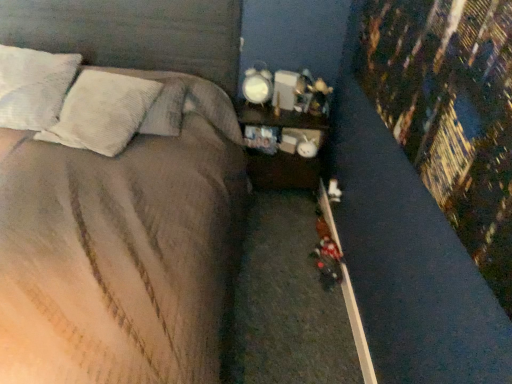
What do you see at coordinates (283, 171) in the screenshot?
I see `wooden nightstand at center` at bounding box center [283, 171].

You are a GUI agent. You are given a task and a screenshot of the screen. Output one action in this format:
    pyautogui.click(x=<x>, y=<y>)
    Task: Click on the white textured pillow at upper left, which ranks as the first pillow in right-to-left order
    The height and width of the screenshot is (384, 512).
    Given the screenshot: What is the action you would take?
    pyautogui.click(x=184, y=103)

What is the approximate width of satin brown bed at center?

7.93 feet.

This screenshot has width=512, height=384. I want to click on white textured pillow at upper left, the second pillow in the right-to-left sequence, so 102,112.

Considering the relative sizes of wooden nightstand at center and white glossy alarm clock at upper right in the image provided, is wooden nightstand at center smaller than white glossy alarm clock at upper right?

No, wooden nightstand at center is not smaller than white glossy alarm clock at upper right.

From a real-world perspective, who is located lower, wooden nightstand at center or white glossy alarm clock at upper right?

wooden nightstand at center is physically lower.

Considering the positions of objects wooden nightstand at center and white glossy alarm clock at upper right in the image provided, who is more to the left, wooden nightstand at center or white glossy alarm clock at upper right?

white glossy alarm clock at upper right.

Is wooden nightstand at center inside or outside of white glossy alarm clock at upper right?

wooden nightstand at center is not inside white glossy alarm clock at upper right, it's outside.

Between satin brown bed at center and white textured pillow at upper left, which ranks as the first pillow in right-to-left order, which one has less height?

white textured pillow at upper left, which ranks as the first pillow in right-to-left order, is shorter.

Which object is closer to the camera taking this photo, satin brown bed at center or white textured pillow at upper left, which ranks as the first pillow in right-to-left order?

satin brown bed at center.

Is satin brown bed at center turned away from white textured pillow at upper left, which ranks as the first pillow in right-to-left order?

Yes, satin brown bed at center is facing away from white textured pillow at upper left, which ranks as the first pillow in right-to-left order.

Is satin brown bed at center positioned far away from white textured pillow at upper left, the 3th pillow viewed from the left?

No, there isn't a large distance between satin brown bed at center and white textured pillow at upper left, the 3th pillow viewed from the left.

Is satin brown bed at center facing towards white glossy alarm clock at upper right?

No, satin brown bed at center is not oriented towards white glossy alarm clock at upper right.

Between satin brown bed at center and white glossy alarm clock at upper right, which one has smaller width?

white glossy alarm clock at upper right is thinner.

From the image's perspective, is satin brown bed at center positioned above or below white glossy alarm clock at upper right?

From the image's perspective, satin brown bed at center appears below white glossy alarm clock at upper right.

How much distance is there between satin brown bed at center and white glossy alarm clock at upper right?

1.03 meters.

How far apart are white textured pillow at upper left, which ranks as the first pillow in right-to-left order, and white textured pillow at upper left, placed as the 3th pillow when sorted from right to left?

white textured pillow at upper left, which ranks as the first pillow in right-to-left order, and white textured pillow at upper left, placed as the 3th pillow when sorted from right to left, are 17.77 inches apart.

Is white textured pillow at upper left, which ranks as the first pillow in right-to-left order, looking in the opposite direction of white textured pillow at upper left, placed as the 3th pillow when sorted from right to left?

No, white textured pillow at upper left, which ranks as the first pillow in right-to-left order, is not facing away from white textured pillow at upper left, placed as the 3th pillow when sorted from right to left.

Is white textured pillow at upper left, the 3th pillow viewed from the left, not inside white textured pillow at upper left, arranged as the 1th pillow when viewed from the left?

That's correct, white textured pillow at upper left, the 3th pillow viewed from the left, is outside of white textured pillow at upper left, arranged as the 1th pillow when viewed from the left.

Considering the relative sizes of white textured pillow at upper left, the 3th pillow viewed from the left, and white textured pillow at upper left, placed as the 3th pillow when sorted from right to left, in the image provided, is white textured pillow at upper left, the 3th pillow viewed from the left, shorter than white textured pillow at upper left, placed as the 3th pillow when sorted from right to left,?

Correct, white textured pillow at upper left, the 3th pillow viewed from the left, is not as tall as white textured pillow at upper left, placed as the 3th pillow when sorted from right to left.

Which is closer to the camera, (42, 90) or (170, 351)?

The point (170, 351) is in front.

Is white textured pillow at upper left, arranged as the 1th pillow when viewed from the left, looking in the opposite direction of satin brown bed at center?

Yes.

Considering their positions, is white textured pillow at upper left, arranged as the 1th pillow when viewed from the left, located in front of or behind satin brown bed at center?

Visually, white textured pillow at upper left, arranged as the 1th pillow when viewed from the left, is located behind satin brown bed at center.

How different are the orientations of white textured pillow at upper left, arranged as the 1th pillow when viewed from the left, and satin brown bed at center in degrees?

white textured pillow at upper left, arranged as the 1th pillow when viewed from the left, and satin brown bed at center are facing 2.11 degrees away from each other.

Is white glossy alarm clock at upper right closer to the viewer compared to white textured pillow at upper left, arranged as the 1th pillow when viewed from the left?

No, it is not.

From their relative heights in the image, would you say white glossy alarm clock at upper right is taller or shorter than white textured pillow at upper left, placed as the 3th pillow when sorted from right to left?

Clearly, white glossy alarm clock at upper right is shorter compared to white textured pillow at upper left, placed as the 3th pillow when sorted from right to left.

From a real-world perspective, who is located lower, white glossy alarm clock at upper right or white textured pillow at upper left, arranged as the 1th pillow when viewed from the left?

white glossy alarm clock at upper right, from a real-world perspective.

Which is behind, point (318, 117) or point (9, 72)?

The point (318, 117) is behind.

Looking at this image, from the image's perspective, is wooden nightstand at center located beneath white textured pillow at upper left, arranged as the 1th pillow when viewed from the left?

Correct, wooden nightstand at center appears lower than white textured pillow at upper left, arranged as the 1th pillow when viewed from the left, in the image.

From a real-world perspective, between wooden nightstand at center and white textured pillow at upper left, arranged as the 1th pillow when viewed from the left, who is vertically lower?

From a 3D spatial view, wooden nightstand at center is below.

You are a GUI agent. You are given a task and a screenshot of the screen. Output one action in this format:
    pyautogui.click(x=<x>, y=<y>)
    Task: Click on the nightstand below the white glossy alarm clock at upper right (from a real-world perspective)
    This screenshot has width=512, height=384.
    Given the screenshot: What is the action you would take?
    [x=283, y=171]

At what (x,y) coordinates should I click in order to perform the action: click on bed on the left of the white textured pillow at upper left, which ranks as the first pillow in right-to-left order. Please return your answer as a coordinate pair (x, y). Looking at the image, I should click on (121, 255).

From the picture: Based on their spatial positions, is satin brown bed at center or white textured pillow at upper left, which is counted as the second pillow, starting from the left, closer to white textured pillow at upper left, placed as the 3th pillow when sorted from right to left?

Based on the image, white textured pillow at upper left, which is counted as the second pillow, starting from the left, appears to be nearer to white textured pillow at upper left, placed as the 3th pillow when sorted from right to left.

Estimate the real-world distances between objects in this image. Which object is closer to white glossy alarm clock at upper right, white textured pillow at upper left, which ranks as the first pillow in right-to-left order, or satin brown bed at center?

Based on the image, white textured pillow at upper left, which ranks as the first pillow in right-to-left order, appears to be nearer to white glossy alarm clock at upper right.

Looking at the image, which one is located further to wooden nightstand at center, white textured pillow at upper left, the 3th pillow viewed from the left, or white textured pillow at upper left, which is counted as the second pillow, starting from the left?

white textured pillow at upper left, which is counted as the second pillow, starting from the left.

Which object lies nearer to the anchor point white glossy alarm clock at upper right, white textured pillow at upper left, the second pillow in the right-to-left sequence, or wooden nightstand at center?

wooden nightstand at center is closer to white glossy alarm clock at upper right.

When comparing their distances from wooden nightstand at center, does white textured pillow at upper left, the 3th pillow viewed from the left, or satin brown bed at center seem closer?

Among the two, white textured pillow at upper left, the 3th pillow viewed from the left, is located nearer to wooden nightstand at center.

Considering their positions, is white textured pillow at upper left, the 3th pillow viewed from the left, positioned further to wooden nightstand at center than white glossy alarm clock at upper right?

Among the two, white textured pillow at upper left, the 3th pillow viewed from the left, is located further to wooden nightstand at center.

Looking at the image, which one is located further to white textured pillow at upper left, arranged as the 1th pillow when viewed from the left, white textured pillow at upper left, which is counted as the second pillow, starting from the left, or white textured pillow at upper left, which ranks as the first pillow in right-to-left order?

white textured pillow at upper left, which ranks as the first pillow in right-to-left order, is positioned further to the anchor white textured pillow at upper left, arranged as the 1th pillow when viewed from the left.

Looking at the image, which one is located further to white textured pillow at upper left, placed as the 3th pillow when sorted from right to left, white textured pillow at upper left, the 3th pillow viewed from the left, or satin brown bed at center?

Among the two, satin brown bed at center is located further to white textured pillow at upper left, placed as the 3th pillow when sorted from right to left.

Where is `pillow situated between white textured pillow at upper left, which is counted as the second pillow, starting from the left, and white glossy alarm clock at upper right from left to right`? pillow situated between white textured pillow at upper left, which is counted as the second pillow, starting from the left, and white glossy alarm clock at upper right from left to right is located at coordinates (184, 103).

The image size is (512, 384). I want to click on pillow located between white textured pillow at upper left, the second pillow in the right-to-left sequence, and wooden nightstand at center in the left-right direction, so click(x=184, y=103).

Find the location of a particular element. bedside lamp situated between white textured pillow at upper left, which ranks as the first pillow in right-to-left order, and wooden nightstand at center from left to right is located at coordinates (258, 84).

Where is `pillow between white textured pillow at upper left, arranged as the 1th pillow when viewed from the left, and white textured pillow at upper left, the 3th pillow viewed from the left, in the horizontal direction`? pillow between white textured pillow at upper left, arranged as the 1th pillow when viewed from the left, and white textured pillow at upper left, the 3th pillow viewed from the left, in the horizontal direction is located at coordinates 102,112.